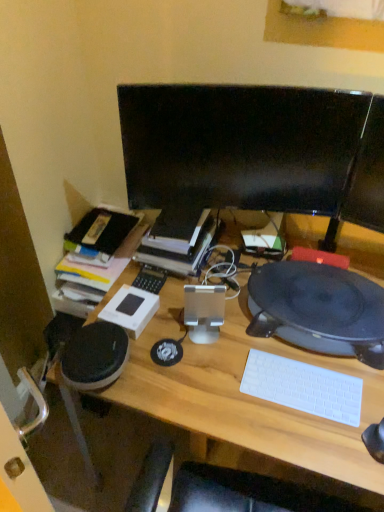
Identify the location of vacant space in front of white plastic keyboard at lower right. (312, 441).